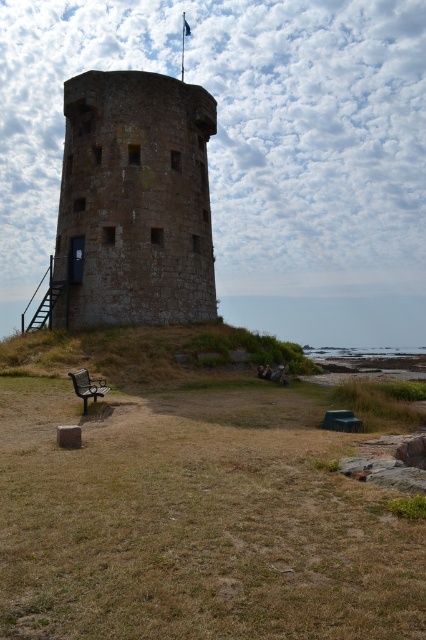
Question: Can you confirm if brown stone tower at center is bigger than wooden bench at lower left?

Choices:
 (A) no
 (B) yes

Answer: (B)

Question: Does brown stone tower at center appear over wooden bench at lower left?

Choices:
 (A) yes
 (B) no

Answer: (A)

Question: Among these objects, which one is farthest from the camera?

Choices:
 (A) wooden bench at lower left
 (B) brown stone tower at center

Answer: (B)

Question: Is brown stone tower at center to the right of wooden bench at lower left from the viewer's perspective?

Choices:
 (A) yes
 (B) no

Answer: (B)